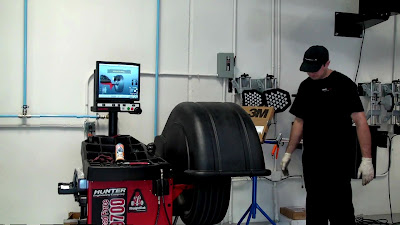
Where is `monitor`? The height and width of the screenshot is (225, 400). monitor is located at coordinates (119, 80).